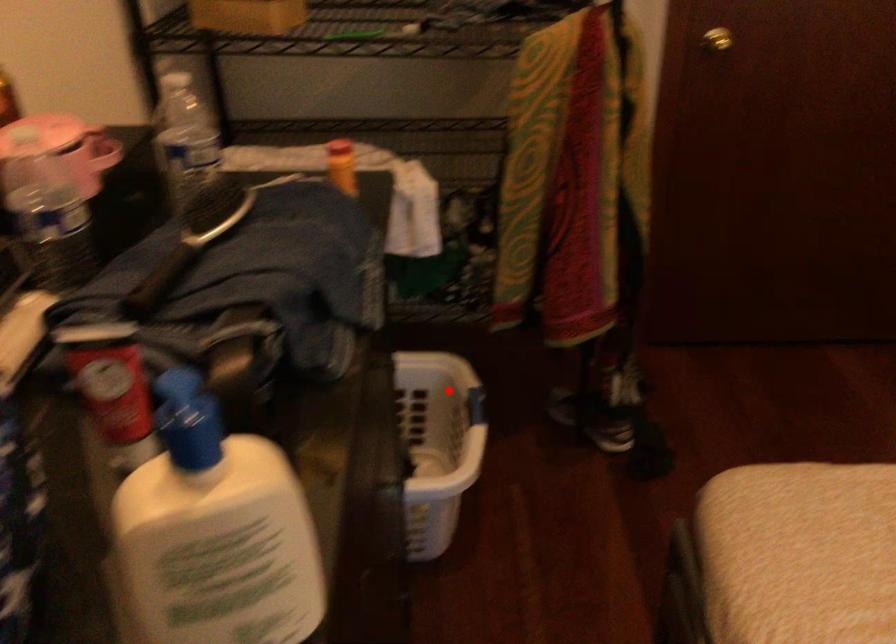
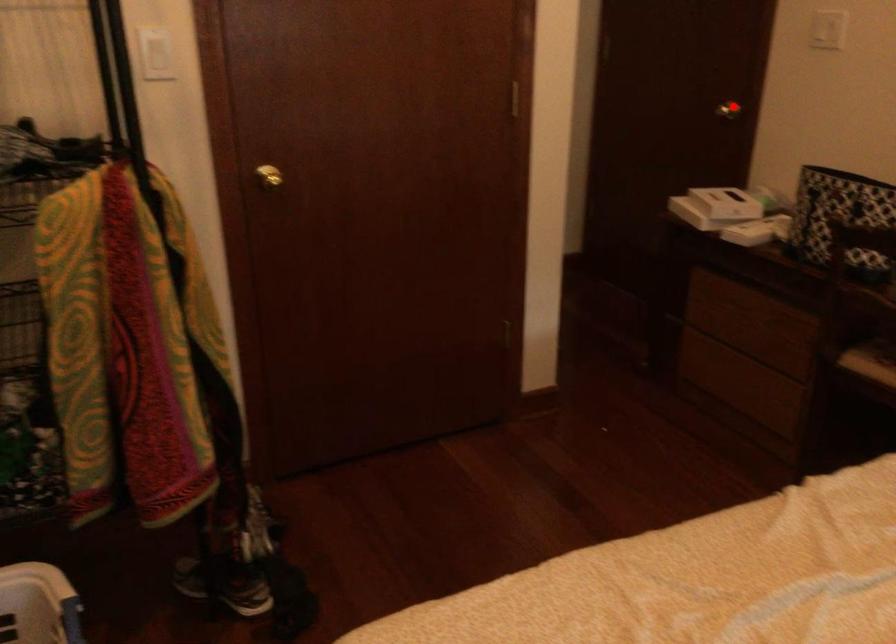
I am providing you with two images of the same scene from different viewpoints. A red point is marked on the first image and another point is marked on the second image. Does the point marked in image1 correspond to the same location as the one in image2?

No